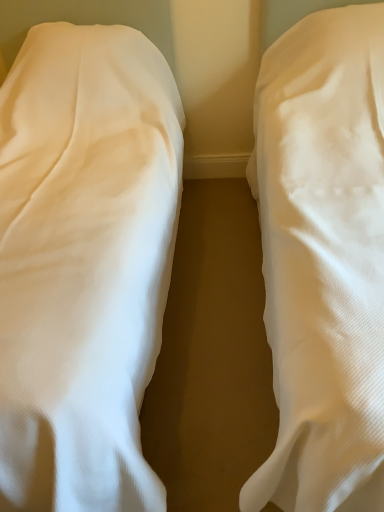
Question: Considering the positions of white textured fabric at center, the second bed from the left, and white fabric bed at left, acting as the 1th bed starting from the left, in the image, is white textured fabric at center, the second bed from the left, wider or thinner than white fabric bed at left, acting as the 1th bed starting from the left,?

Choices:
 (A) thin
 (B) wide

Answer: (A)

Question: Is point (294, 435) positioned closer to the camera than point (125, 321)?

Choices:
 (A) farther
 (B) closer

Answer: (B)

Question: Relative to white fabric bed at left, acting as the 1th bed starting from the left, is white textured fabric at center, which appears as the first bed when viewed from the right, in front or behind?

Choices:
 (A) behind
 (B) front

Answer: (B)

Question: From a real-world perspective, is white fabric bed at left, acting as the 1th bed starting from the left, physically located above or below white textured fabric at center, which appears as the first bed when viewed from the right?

Choices:
 (A) below
 (B) above

Answer: (B)

Question: From the image's perspective, relative to white textured fabric at center, which appears as the first bed when viewed from the right, is white fabric bed at left, acting as the 1th bed starting from the left, above or below?

Choices:
 (A) above
 (B) below

Answer: (B)

Question: Is point (134, 311) closer or farther from the camera than point (297, 288)?

Choices:
 (A) farther
 (B) closer

Answer: (A)

Question: Looking at their shapes, would you say white fabric bed at left, acting as the 1th bed starting from the left, is wider or thinner than white textured fabric at center, which appears as the first bed when viewed from the right?

Choices:
 (A) wide
 (B) thin

Answer: (A)